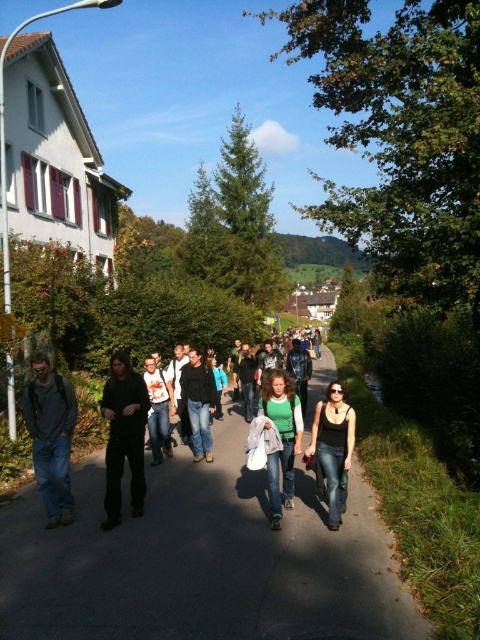
You are standing at the point marked by the coordinates point (x=203, y=561). Looking around, you see the gray asphalt pavement at center. Which direction should you walk to reach the building with white walls and red shutters located on the left side of the path?

The gray asphalt pavement at center is represented by point (x=203, y=561). Since the building with white walls and red shutters is on the left side of the path, you should walk along the gray asphalt pavement at center towards the left side to reach the building.

Based on the photo, you are a photographer standing on the path and want to take a photo that includes both the dark matte clothing at center and the green matte shirt at center. Which one will appear closer to the camera in the photo?

The dark matte clothing at center will appear closer to the camera in the photo because it is further to the viewer than the green matte shirt at center, meaning it is positioned nearer to the photographer.